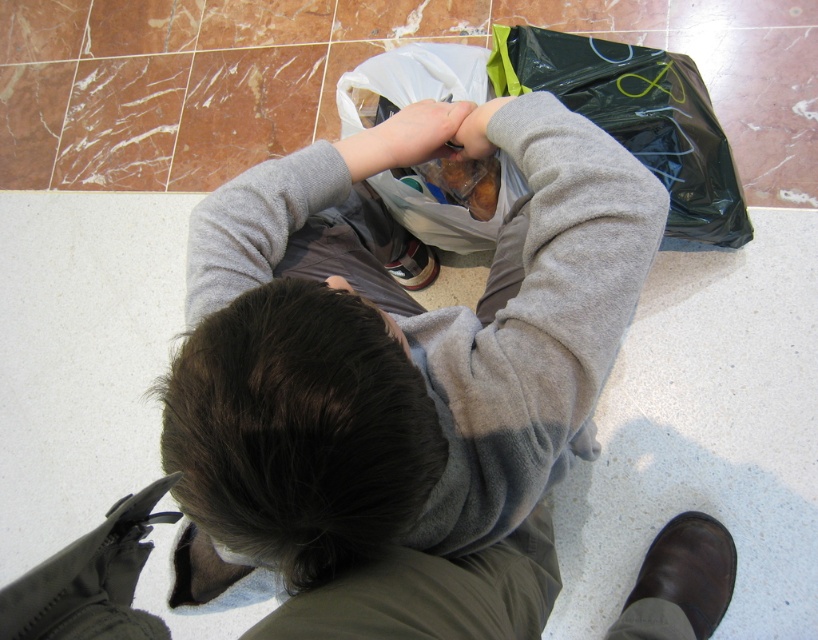
Consider the image. You are a person who needs to reach the black plastic bag at center without moving the gray fleece sweatshirt at center. How can you do this?

Move to the right side of the black plastic bag at center since the gray fleece sweatshirt at center is located to its left.

You are a photographer trying to capture the scene where a person is cutting a plastic bag. You notice the dark brown hair at center and the matte gray hand at center. Which object in the scene is bigger?

The dark brown hair at center is larger in size than the matte gray hand at center.